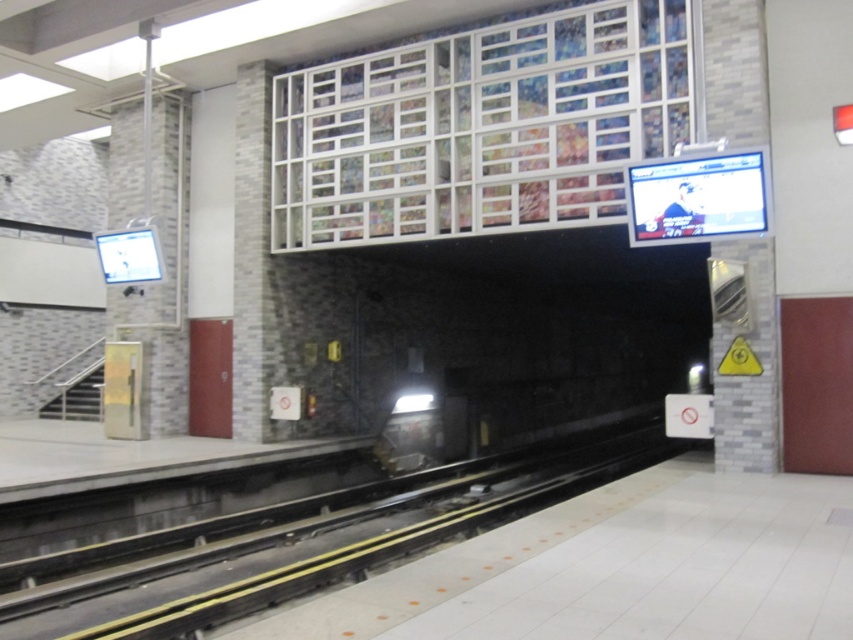
Does black rubber train track at center have a lesser height compared to metallic gray train at center?

Correct, black rubber train track at center is not as tall as metallic gray train at center.

Does black rubber train track at center have a lesser width compared to metallic gray train at center?

No, black rubber train track at center is not thinner than metallic gray train at center.

Is point (183, 538) less distant than point (387, 420)?

That is True.

This screenshot has height=640, width=853. I want to click on black rubber train track at center, so click(x=300, y=541).